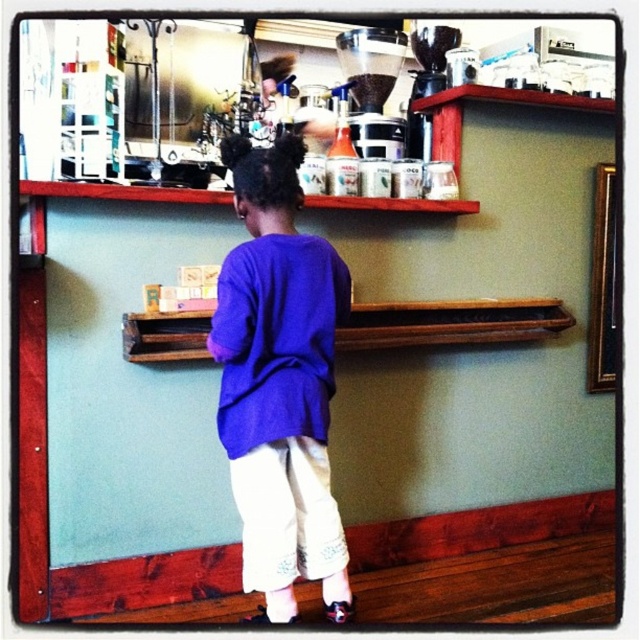
Is purple cotton shirt at center bigger than matte black coffee grinder at upper center?

Yes.

Between purple cotton shirt at center and matte black coffee grinder at upper center, which one has less height?

With less height is matte black coffee grinder at upper center.

Is point (259, 516) closer to camera compared to point (372, 61)?

Yes, it is.

Where is `purple cotton shirt at center`? The width and height of the screenshot is (640, 640). purple cotton shirt at center is located at coordinates (280, 381).